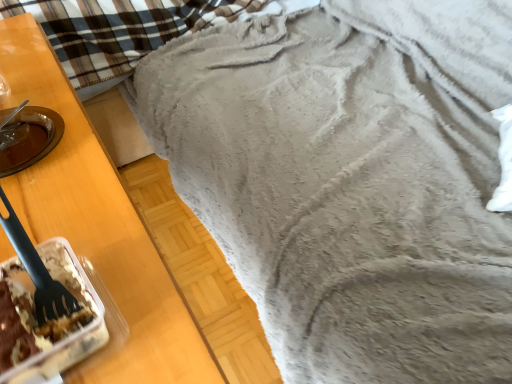
Question: From a real-world perspective, is black plastic fork at left physically located above or below fuzzy gray blanket at upper right?

Choices:
 (A) below
 (B) above

Answer: (B)

Question: From the image's perspective, is black plastic fork at left located above or below fuzzy gray blanket at upper right?

Choices:
 (A) below
 (B) above

Answer: (B)

Question: Which object is the farthest from the fuzzy gray blanket at upper right?

Choices:
 (A) translucent plastic container with cake at lower left
 (B) black plastic fork at left

Answer: (B)

Question: Which object is the farthest from the black plastic fork at left?

Choices:
 (A) translucent plastic container with cake at lower left
 (B) fuzzy gray blanket at upper right

Answer: (B)